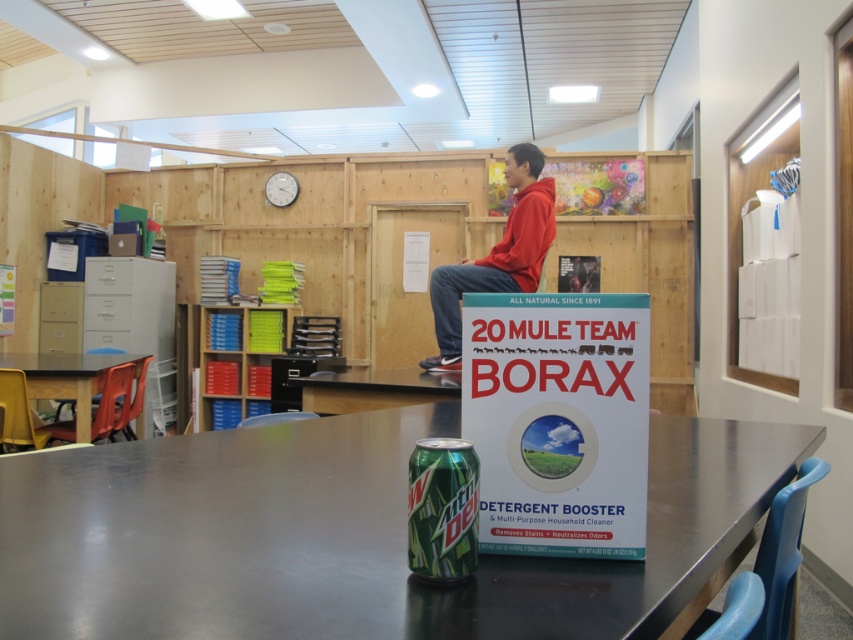
You are a student in the classroom and you want to place your red hoodie at upper center on the metallic gray table at center. Will it fit?

The metallic gray table at center is bigger than red hoodie at upper center, so yes, the red hoodie at upper center will fit on the metallic gray table at center.

You are a student in the classroom and want to place your red hoodie at upper center on the metallic gray table at center. Can you do this without moving any other items on the table?

The metallic gray table at center is to the left of red hoodie at upper center, so the red hoodie at upper center is currently positioned to the right of the table. Since the hoodie is already placed on the correct side of the table, you can place it there without moving other items.